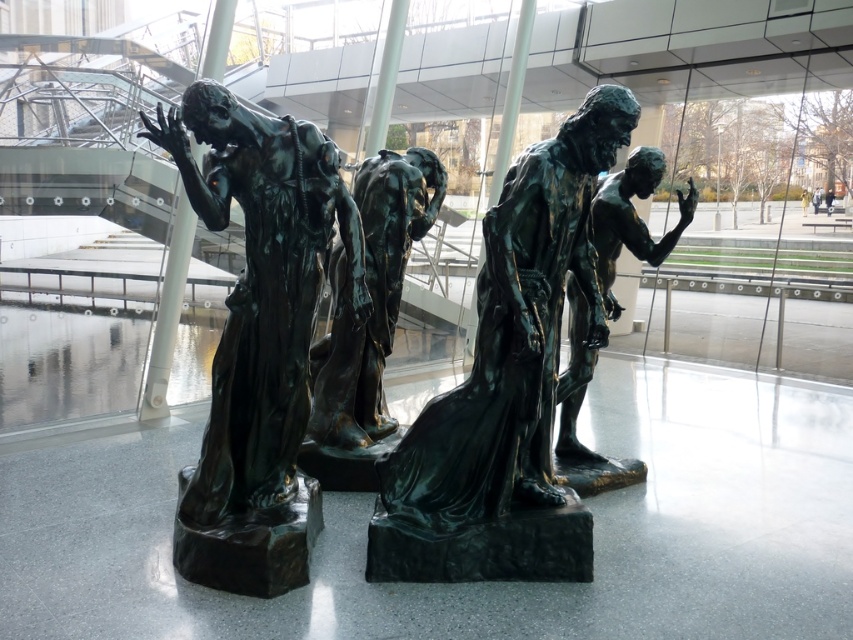
You are an interior designer arranging items in a modern space. You have a bronze statue at center and a light brown leather jacket at center. According to the spatial arrangement, which object is positioned to the left when viewed from the front?

The bronze statue at center is positioned to the left of the light brown leather jacket at center.